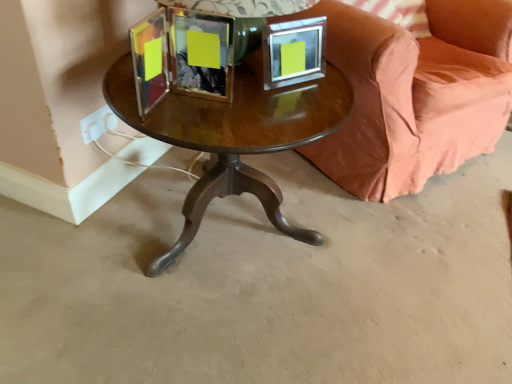
Image resolution: width=512 pixels, height=384 pixels. In order to click on vacant space in front of velvet coral couch at center in this screenshot , I will do point(397,265).